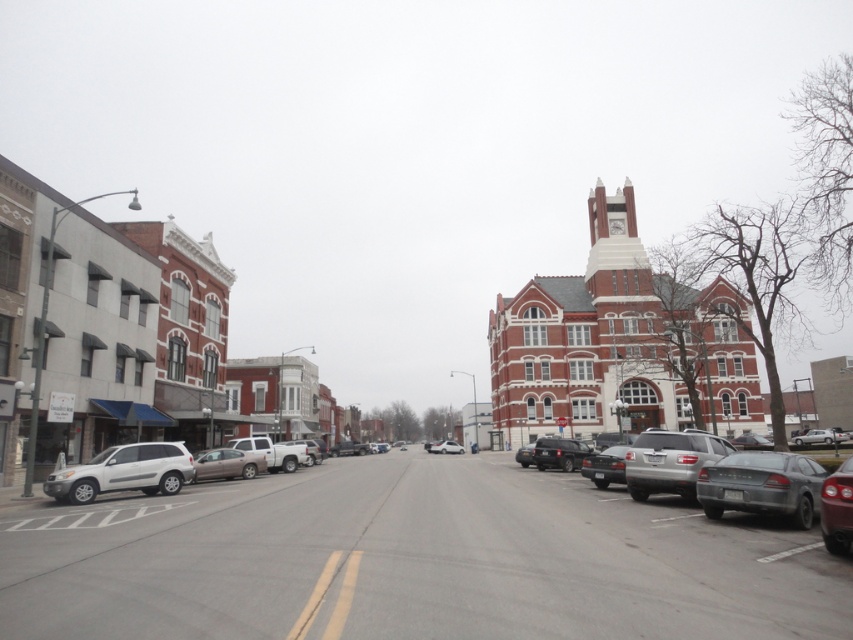
You are standing at the center of the street looking towards the large red brick building with the clock tower. There are two points marked on the image, one at coordinate point (827, 504) and another at point (430, 451). Which of these two points is closer to your current position?

Point (827, 504) is closer to the camera than point (430, 451), so the point at coordinate (827, 504) is closer to your current position.

You are a pedestrian standing on the sidewalk near the large red brick building with a clock tower. You want to cross the street to reach the shiny red sedan at right. Is the satin silver suv at lower left blocking your path?

The satin silver suv at lower left is further to the viewer than the shiny red sedan at right, so it is closer to you. This means the satin silver suv at lower left is blocking your path to the shiny red sedan at right.